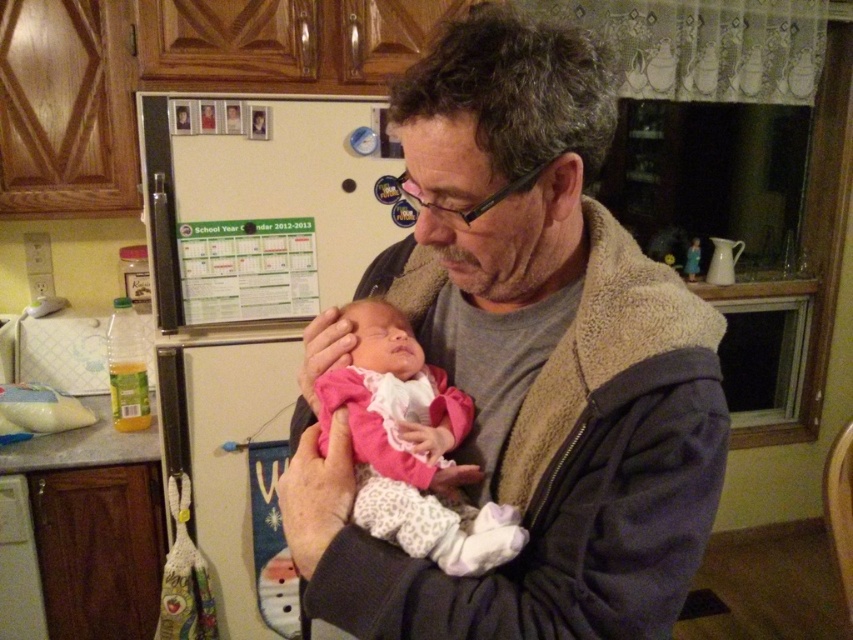
You are a photographer trying to capture a portrait of the gray fleece jacket at center and the pink fleece baby at center. Since you want both subjects to appear in focus, you need to adjust the camera settings based on their sizes. Which subject should you focus on to ensure both are sharp?

The gray fleece jacket at center is taller than the pink fleece baby at center, so focusing on the taller subject, the gray fleece jacket at center, will help ensure both are in focus.

You are a photographer trying to capture a closeup shot of the gray fleece jacket at center and the pink fleece baby at center. Since you want to focus on the baby, which object should you move closer to the camera?

The gray fleece jacket at center is bigger than the pink fleece baby at center, so to focus on the baby, you should move the gray fleece jacket at center closer to the camera to ensure it doesn

You are a tailor measuring the distance between the gray fleece jacket at center and the pink fleece baby at center for a custom fitting. Can you fit a 4.5 inch wide decorative pin between them?

The distance between the gray fleece jacket at center and the pink fleece baby at center is 4.45 inches, so the 4.5 inch wide decorative pin cannot fit between them as it is slightly wider than the available space.